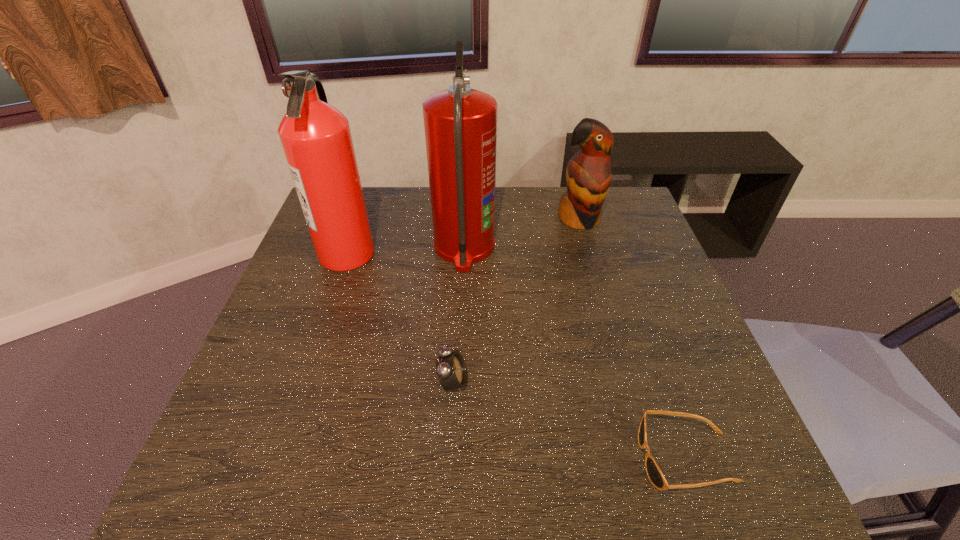
Locate an element on the screen. the right fire extinguisher is located at coordinates (460, 123).

The width and height of the screenshot is (960, 540). I want to click on the left fire extinguisher, so click(x=316, y=138).

I want to click on the third shortest object, so click(588, 175).

The height and width of the screenshot is (540, 960). I want to click on the second nearest object, so click(x=451, y=370).

This screenshot has width=960, height=540. I want to click on the second shortest object, so click(451, 370).

Identify the location of sunglasses. This screenshot has height=540, width=960. (653, 471).

Locate an element on the screen. The height and width of the screenshot is (540, 960). the shortest object is located at coordinates (653, 471).

Find the location of a particular element. This screenshot has width=960, height=540. vacant space located 0.260m on the instruction side of the right fire extinguisher is located at coordinates (587, 248).

At what (x,y) coordinates should I click in order to perform the action: click on vacant space positioned at the nozzle of the left fire extinguisher. Please return your answer as a coordinate pair (x, y). The width and height of the screenshot is (960, 540). Looking at the image, I should click on (435, 253).

This screenshot has width=960, height=540. I want to click on free space located on the face of the parrot, so click(x=602, y=304).